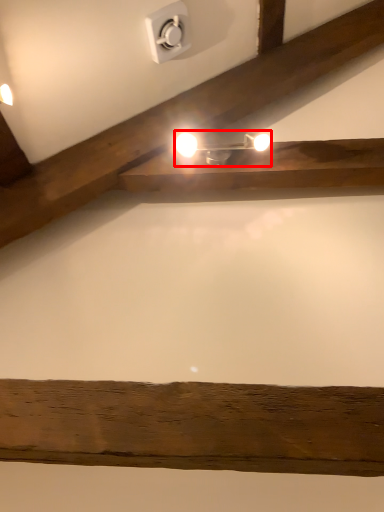
Question: In this image, where is lamp (annotated by the red box) located relative to electric outlet?

Choices:
 (A) left
 (B) right

Answer: (B)